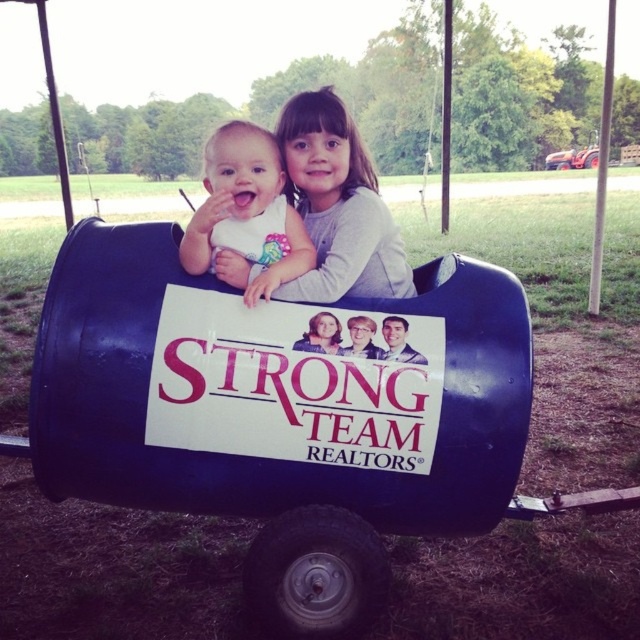
Question: Is gray soft shirt at upper center above matte white bib at center?

Choices:
 (A) no
 (B) yes

Answer: (B)

Question: Which point is closer to the camera taking this photo?

Choices:
 (A) (310, 225)
 (B) (237, 220)

Answer: (B)

Question: Does gray soft shirt at upper center come in front of matte white bib at center?

Choices:
 (A) no
 (B) yes

Answer: (A)

Question: Can you confirm if gray soft shirt at upper center is wider than matte white bib at center?

Choices:
 (A) yes
 (B) no

Answer: (A)

Question: Among these objects, which one is nearest to the camera?

Choices:
 (A) matte white bib at center
 (B) gray soft shirt at upper center

Answer: (A)